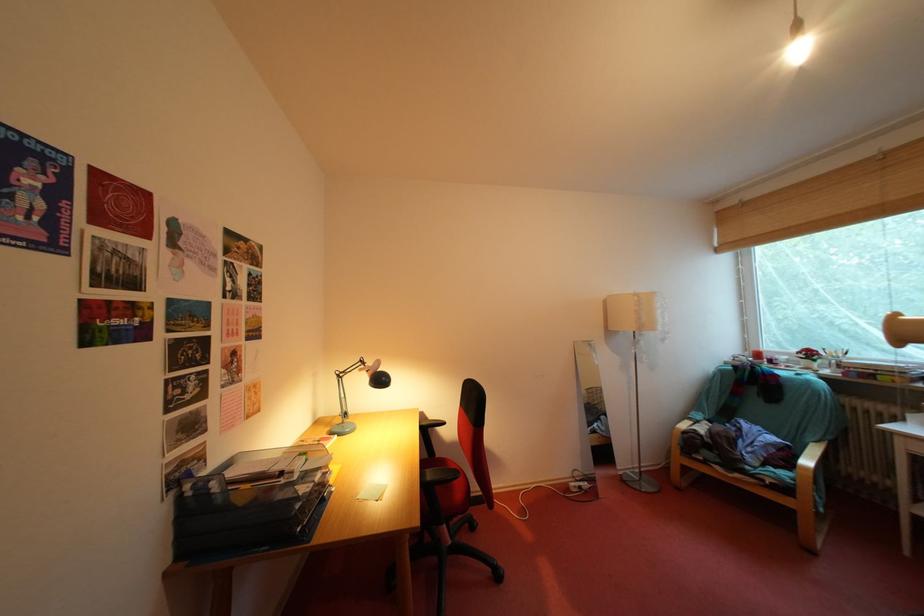
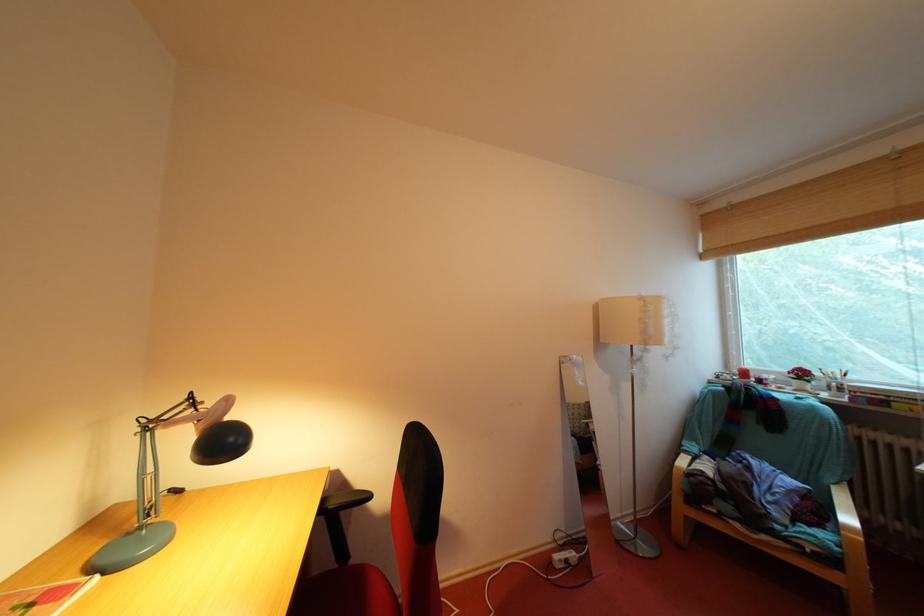
Find the pixel in the second image that matches (760,359) in the first image.

(746, 377)